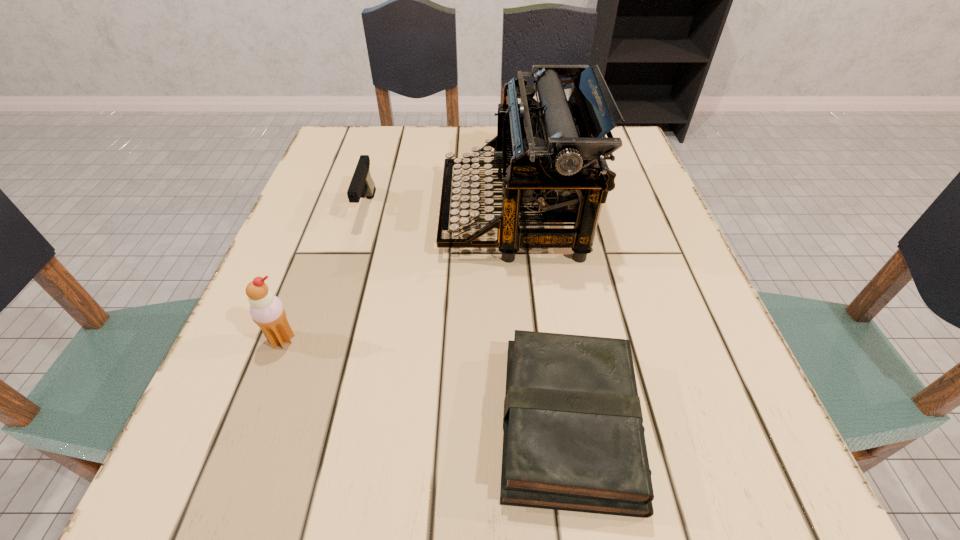
At what (x,y) coordinates should I click in order to perform the action: click on vacant area situated on the front-facing side of the third object from right to left. Please return your answer as a coordinate pair (x, y). The height and width of the screenshot is (540, 960). Looking at the image, I should click on (328, 342).

Locate an element on the screen. This screenshot has height=540, width=960. vacant area situated on the right of the shortest object is located at coordinates (729, 423).

In order to click on object that is at the far edge in this screenshot , I will do (x=551, y=152).

The height and width of the screenshot is (540, 960). I want to click on object at the near edge, so click(573, 440).

Where is `icecream located at the left edge`? icecream located at the left edge is located at coordinates (267, 311).

Identify the location of pistol at the left edge. (362, 184).

Identify the location of object situated at the right edge. The image size is (960, 540). (573, 440).

Identify the location of object at the near right corner. Image resolution: width=960 pixels, height=540 pixels. (573, 440).

Image resolution: width=960 pixels, height=540 pixels. Find the location of `blank space at the far edge`. blank space at the far edge is located at coordinates (448, 138).

Find the location of a particular element. vacant space at the left edge of the desktop is located at coordinates (290, 397).